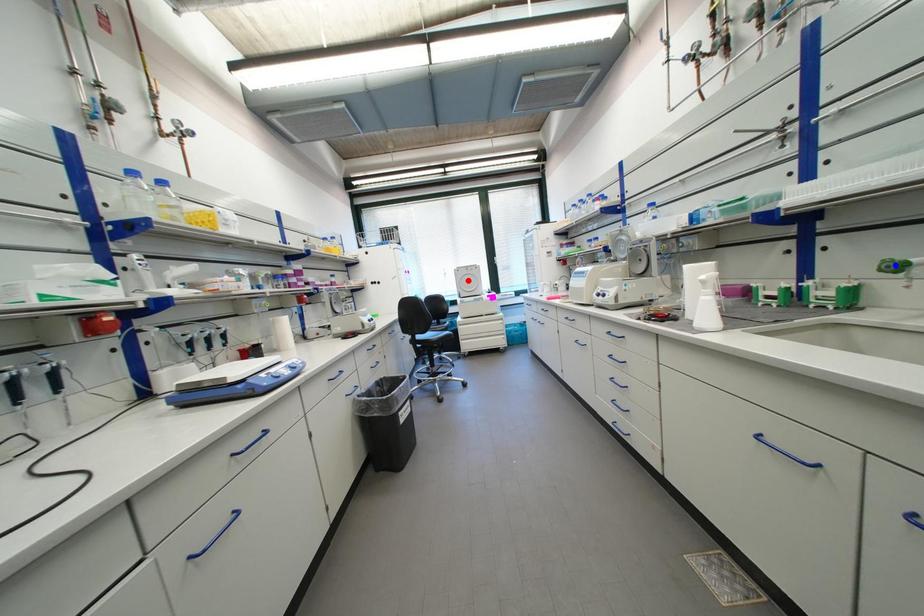
Question: Which of the two points in the image is closer to the camera?

Choices:
 (A) Blue point is closer.
 (B) Red point is closer.

Answer: (A)